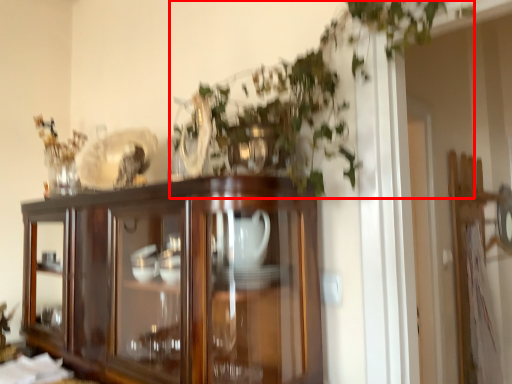
Question: Where is vegetation (annotated by the red box) located in relation to cupboard in the image?

Choices:
 (A) right
 (B) left

Answer: (A)